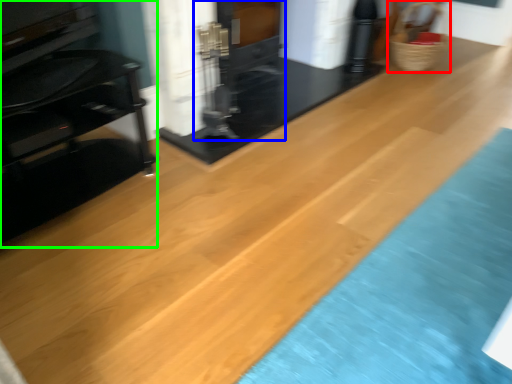
Question: Which is farther away from basket (highlighted by a red box)? fireplace (highlighted by a blue box) or furniture (highlighted by a green box)?

Choices:
 (A) fireplace
 (B) furniture

Answer: (B)